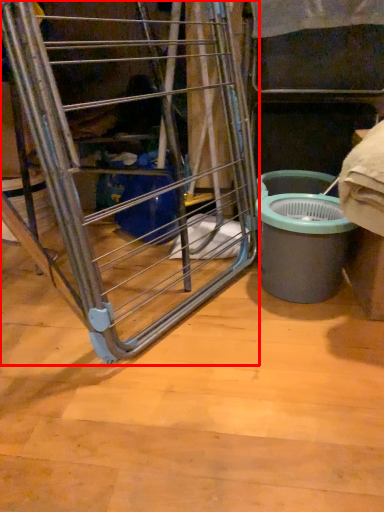
Question: From the image's perspective, what is the correct spatial relationship of ladder (annotated by the red box) in relation to waste container?

Choices:
 (A) above
 (B) below

Answer: (A)